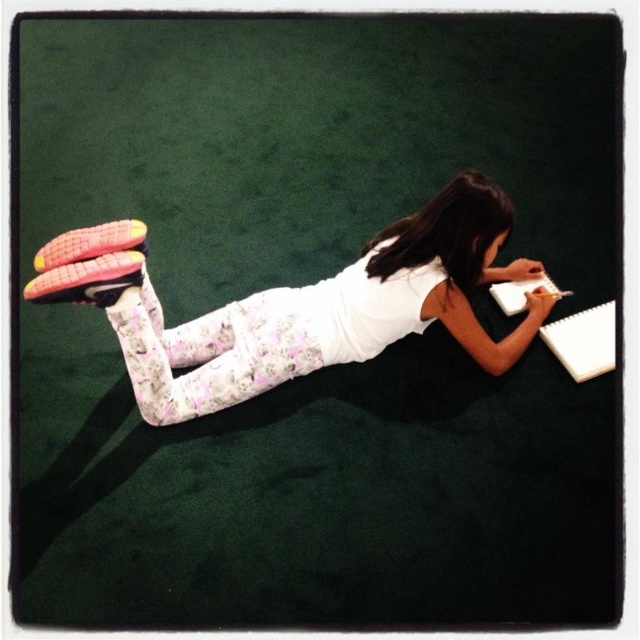
Question: Can you confirm if pink fabric leggings at upper center is bigger than white paper at lower right?

Choices:
 (A) yes
 (B) no

Answer: (A)

Question: Which of the following is the farthest from the observer?

Choices:
 (A) (584, 324)
 (B) (227, 392)

Answer: (A)

Question: Does white matte notebook at lower right appear under white paper at lower right?

Choices:
 (A) yes
 (B) no

Answer: (A)

Question: Which of the following is the farthest from the observer?

Choices:
 (A) white matte notebook at lower right
 (B) pink fabric leggings at upper center
 (C) white paper at lower right

Answer: (C)

Question: Which object appears farthest from the camera in this image?

Choices:
 (A) white paper at lower right
 (B) white matte notebook at lower right
 (C) pink fabric leggings at upper center

Answer: (A)

Question: Observing the image, what is the correct spatial positioning of pink fabric leggings at upper center in reference to white paper at lower right?

Choices:
 (A) above
 (B) below

Answer: (B)